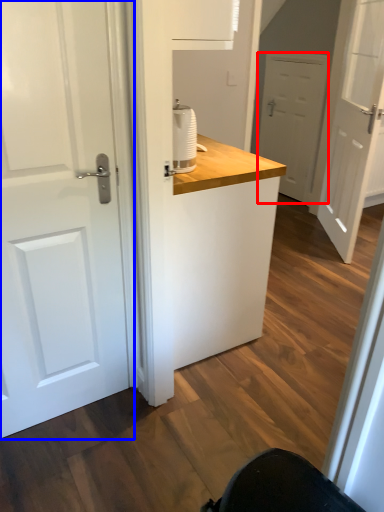
Question: Which point is further to the camera, door (highlighted by a red box) or door (highlighted by a blue box)?

Choices:
 (A) door
 (B) door

Answer: (A)